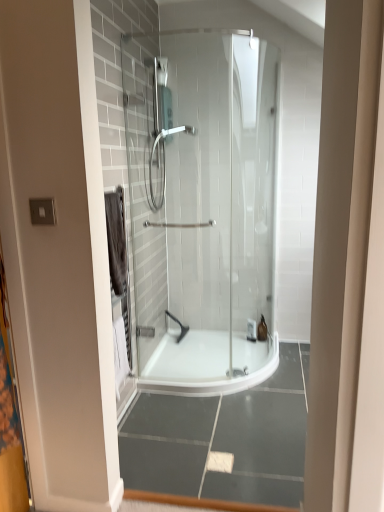
What do you see at coordinates (164, 158) in the screenshot?
I see `matte silver shower head at center, which is the 1th shower from front to back` at bounding box center [164, 158].

The image size is (384, 512). In order to click on white plastic bottle at center, arranged as the 2th toiletry when viewed from the right in this screenshot , I will do `click(251, 330)`.

Find the location of `black rubber showerhead at center, the first shower from the back`. black rubber showerhead at center, the first shower from the back is located at coordinates (x=179, y=326).

Locate an element on the screen. matte silver shower head at center, arranged as the second shower when ordered from the bottom is located at coordinates (164, 158).

Does white plastic bottle at center, arranged as the 2th toiletry when viewed from the right, have a greater width compared to matte silver shower head at center, arranged as the second shower when ordered from the bottom?

Incorrect, the width of white plastic bottle at center, arranged as the 2th toiletry when viewed from the right, does not surpass that of matte silver shower head at center, arranged as the second shower when ordered from the bottom.

Is there a large distance between white plastic bottle at center, which is the first toiletry from left to right, and matte silver shower head at center, which is the 1th shower from front to back?

Yes, white plastic bottle at center, which is the first toiletry from left to right, and matte silver shower head at center, which is the 1th shower from front to back, are located far from each other.

From the image's perspective, is white plastic bottle at center, which is the first toiletry from left to right, located above or below matte silver shower head at center, marked as the 2th shower in a back-to-front arrangement?

Clearly, from the image's perspective, white plastic bottle at center, which is the first toiletry from left to right, is below matte silver shower head at center, marked as the 2th shower in a back-to-front arrangement.

Would you say black rubber showerhead at center, marked as the second shower in a top-to-bottom arrangement, is part of matte silver shower head at center, marked as the 2th shower in a back-to-front arrangement,'s contents?

Actually, black rubber showerhead at center, marked as the second shower in a top-to-bottom arrangement, is outside matte silver shower head at center, marked as the 2th shower in a back-to-front arrangement.

From a real-world perspective, is matte silver shower head at center, which is the 1th shower from front to back, beneath black rubber showerhead at center, which is counted as the first shower, starting from the bottom?

No, from a real-world perspective, matte silver shower head at center, which is the 1th shower from front to back, is not under black rubber showerhead at center, which is counted as the first shower, starting from the bottom.

Considering the sizes of matte silver shower head at center, the 1th shower when ordered from top to bottom, and black rubber showerhead at center, the first shower from the back, in the image, is matte silver shower head at center, the 1th shower when ordered from top to bottom, bigger or smaller than black rubber showerhead at center, the first shower from the back,?

matte silver shower head at center, the 1th shower when ordered from top to bottom, is bigger than black rubber showerhead at center, the first shower from the back.

Can you tell me how much black rubber showerhead at center, marked as the second shower in a top-to-bottom arrangement, and white plastic bottle at center, arranged as the 2th toiletry when viewed from the right, differ in facing direction?

There is a 0.000537-degree angle between the facing directions of black rubber showerhead at center, marked as the second shower in a top-to-bottom arrangement, and white plastic bottle at center, arranged as the 2th toiletry when viewed from the right.

Is black rubber showerhead at center, the first shower from the back, not near white plastic bottle at center, arranged as the 2th toiletry when viewed from the right?

No.

Considering the sizes of objects black rubber showerhead at center, marked as the second shower in a top-to-bottom arrangement, and white plastic bottle at center, arranged as the 2th toiletry when viewed from the right, in the image provided, who is smaller, black rubber showerhead at center, marked as the second shower in a top-to-bottom arrangement, or white plastic bottle at center, arranged as the 2th toiletry when viewed from the right,?

white plastic bottle at center, arranged as the 2th toiletry when viewed from the right.

From the image's perspective, which one is positioned higher, black rubber showerhead at center, which ranks as the 2th shower in front-to-back order, or white plastic bottle at center, arranged as the 2th toiletry when viewed from the right?

black rubber showerhead at center, which ranks as the 2th shower in front-to-back order, is shown above in the image.

From the image's perspective, which is above, translucent glass toiletry at center, which ranks as the second toiletry in left-to-right order, or black rubber showerhead at center, marked as the second shower in a top-to-bottom arrangement?

From the image's view, black rubber showerhead at center, marked as the second shower in a top-to-bottom arrangement, is above.

Can you confirm if translucent glass toiletry at center, which ranks as the second toiletry in left-to-right order, is taller than black rubber showerhead at center, the first shower from the back?

Indeed, translucent glass toiletry at center, which ranks as the second toiletry in left-to-right order, has a greater height compared to black rubber showerhead at center, the first shower from the back.

Which object is further away from the camera, translucent glass toiletry at center, which ranks as the second toiletry in left-to-right order, or black rubber showerhead at center, which ranks as the 2th shower in front-to-back order?

black rubber showerhead at center, which ranks as the 2th shower in front-to-back order, is further from the camera.

Consider the image. Measure the distance between translucent glass toiletry at center, which ranks as the second toiletry in left-to-right order, and black rubber showerhead at center, which is counted as the first shower, starting from the bottom.

They are 25.98 inches apart.

Is translucent glass toiletry at center, which ranks as the second toiletry in left-to-right order, inside or outside of white plastic bottle at center, arranged as the 2th toiletry when viewed from the right?

translucent glass toiletry at center, which ranks as the second toiletry in left-to-right order, lies outside white plastic bottle at center, arranged as the 2th toiletry when viewed from the right.

Is translucent glass toiletry at center, the 1th toiletry when ordered from right to left, taller than white plastic bottle at center, arranged as the 2th toiletry when viewed from the right?

Answer: Yes.

Considering the sizes of objects translucent glass toiletry at center, which ranks as the second toiletry in left-to-right order, and white plastic bottle at center, arranged as the 2th toiletry when viewed from the right, in the image provided, who is bigger, translucent glass toiletry at center, which ranks as the second toiletry in left-to-right order, or white plastic bottle at center, arranged as the 2th toiletry when viewed from the right,?

translucent glass toiletry at center, which ranks as the second toiletry in left-to-right order.

From the picture: How far apart are translucent glass toiletry at center, which ranks as the second toiletry in left-to-right order, and white plastic bottle at center, arranged as the 2th toiletry when viewed from the right?

translucent glass toiletry at center, which ranks as the second toiletry in left-to-right order, is 2.75 inches away from white plastic bottle at center, arranged as the 2th toiletry when viewed from the right.

Does translucent glass toiletry at center, the 1th toiletry when ordered from right to left, appear on the left side of matte silver shower head at center, marked as the 2th shower in a back-to-front arrangement?

No, translucent glass toiletry at center, the 1th toiletry when ordered from right to left, is not to the left of matte silver shower head at center, marked as the 2th shower in a back-to-front arrangement.

Does translucent glass toiletry at center, the 1th toiletry when ordered from right to left, have a lesser width compared to matte silver shower head at center, marked as the 2th shower in a back-to-front arrangement?

Yes, translucent glass toiletry at center, the 1th toiletry when ordered from right to left, is thinner than matte silver shower head at center, marked as the 2th shower in a back-to-front arrangement.

Is translucent glass toiletry at center, which ranks as the second toiletry in left-to-right order, inside or outside of matte silver shower head at center, arranged as the second shower when ordered from the bottom?

translucent glass toiletry at center, which ranks as the second toiletry in left-to-right order, is spatially situated outside matte silver shower head at center, arranged as the second shower when ordered from the bottom.

The height and width of the screenshot is (512, 384). Find the location of `toiletry below the translucent glass toiletry at center, which ranks as the second toiletry in left-to-right order (from a real-world perspective)`. toiletry below the translucent glass toiletry at center, which ranks as the second toiletry in left-to-right order (from a real-world perspective) is located at coordinates (251, 330).

In the scene shown: Does white plastic bottle at center, which is the first toiletry from left to right, have a greater width compared to translucent glass toiletry at center, the 1th toiletry when ordered from right to left?

Incorrect, the width of white plastic bottle at center, which is the first toiletry from left to right, does not surpass that of translucent glass toiletry at center, the 1th toiletry when ordered from right to left.

Who is more distant, white plastic bottle at center, which is the first toiletry from left to right, or translucent glass toiletry at center, which ranks as the second toiletry in left-to-right order?

translucent glass toiletry at center, which ranks as the second toiletry in left-to-right order.

Is white plastic bottle at center, which is the first toiletry from left to right, facing away from translucent glass toiletry at center, the 1th toiletry when ordered from right to left?

That's not correct — white plastic bottle at center, which is the first toiletry from left to right, is not looking away from translucent glass toiletry at center, the 1th toiletry when ordered from right to left.

Which toiletry is the 1st one when counting from the back of the matte silver shower head at center, the 1th shower when ordered from top to bottom? Please provide its 2D coordinates.

[(251, 330)]

Locate an element on the screen. The width and height of the screenshot is (384, 512). shower that is under the matte silver shower head at center, which is the 1th shower from front to back (from a real-world perspective) is located at coordinates (179, 326).

Considering their positions, is black rubber showerhead at center, which is counted as the first shower, starting from the bottom, positioned closer to matte silver shower head at center, which is the 1th shower from front to back, than white plastic bottle at center, which is the first toiletry from left to right?

black rubber showerhead at center, which is counted as the first shower, starting from the bottom.

When comparing their distances from white plastic bottle at center, which is the first toiletry from left to right, does matte silver shower head at center, the 1th shower when ordered from top to bottom, or black rubber showerhead at center, marked as the second shower in a top-to-bottom arrangement, seem further?

matte silver shower head at center, the 1th shower when ordered from top to bottom, lies further to white plastic bottle at center, which is the first toiletry from left to right, than the other object.

From the image, which object appears to be nearer to white plastic bottle at center, arranged as the 2th toiletry when viewed from the right, translucent glass toiletry at center, the 1th toiletry when ordered from right to left, or matte silver shower head at center, arranged as the second shower when ordered from the bottom?

translucent glass toiletry at center, the 1th toiletry when ordered from right to left, is closer to white plastic bottle at center, arranged as the 2th toiletry when viewed from the right.

Considering their positions, is matte silver shower head at center, arranged as the second shower when ordered from the bottom, positioned closer to black rubber showerhead at center, marked as the second shower in a top-to-bottom arrangement, than white plastic bottle at center, which is the first toiletry from left to right?

The object closer to black rubber showerhead at center, marked as the second shower in a top-to-bottom arrangement, is white plastic bottle at center, which is the first toiletry from left to right.

Which object lies further to the anchor point translucent glass toiletry at center, which ranks as the second toiletry in left-to-right order, black rubber showerhead at center, which ranks as the 2th shower in front-to-back order, or white plastic bottle at center, which is the first toiletry from left to right?

black rubber showerhead at center, which ranks as the 2th shower in front-to-back order, is positioned further to the anchor translucent glass toiletry at center, which ranks as the second toiletry in left-to-right order.

Looking at the image, which one is located further to translucent glass toiletry at center, which ranks as the second toiletry in left-to-right order, matte silver shower head at center, marked as the 2th shower in a back-to-front arrangement, or black rubber showerhead at center, which ranks as the 2th shower in front-to-back order?

matte silver shower head at center, marked as the 2th shower in a back-to-front arrangement, is positioned further to the anchor translucent glass toiletry at center, which ranks as the second toiletry in left-to-right order.

From the image, which object appears to be farther from black rubber showerhead at center, the first shower from the back, translucent glass toiletry at center, which ranks as the second toiletry in left-to-right order, or white plastic bottle at center, which is the first toiletry from left to right?

The object further to black rubber showerhead at center, the first shower from the back, is translucent glass toiletry at center, which ranks as the second toiletry in left-to-right order.

When comparing their distances from matte silver shower head at center, marked as the 2th shower in a back-to-front arrangement, does white plastic bottle at center, arranged as the 2th toiletry when viewed from the right, or black rubber showerhead at center, which ranks as the 2th shower in front-to-back order, seem further?

white plastic bottle at center, arranged as the 2th toiletry when viewed from the right, is further to matte silver shower head at center, marked as the 2th shower in a back-to-front arrangement.

Identify the location of toiletry between matte silver shower head at center, arranged as the second shower when ordered from the bottom, and white plastic bottle at center, arranged as the 2th toiletry when viewed from the right, in the up-down direction. The width and height of the screenshot is (384, 512). (262, 329).

Locate an element on the screen. shower between matte silver shower head at center, marked as the 2th shower in a back-to-front arrangement, and white plastic bottle at center, arranged as the 2th toiletry when viewed from the right, vertically is located at coordinates (179, 326).

The width and height of the screenshot is (384, 512). I want to click on shower between matte silver shower head at center, arranged as the second shower when ordered from the bottom, and translucent glass toiletry at center, which ranks as the second toiletry in left-to-right order, from top to bottom, so click(x=179, y=326).

Where is `toiletry situated between black rubber showerhead at center, which is counted as the first shower, starting from the bottom, and translucent glass toiletry at center, the 1th toiletry when ordered from right to left, from left to right`? The height and width of the screenshot is (512, 384). toiletry situated between black rubber showerhead at center, which is counted as the first shower, starting from the bottom, and translucent glass toiletry at center, the 1th toiletry when ordered from right to left, from left to right is located at coordinates (251, 330).